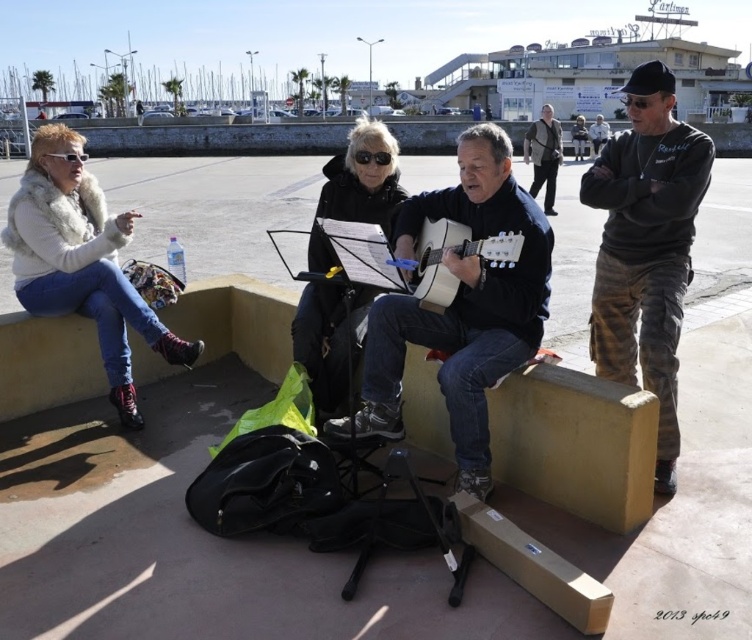
Question: Is matte black guitar at center positioned in front of fuzzy white fur vest at left?

Choices:
 (A) yes
 (B) no

Answer: (A)

Question: Which of the following is the closest to the observer?

Choices:
 (A) (411, 218)
 (B) (543, 120)
 (C) (438, 252)

Answer: (C)

Question: Is matte black guitar at center bigger than black matte jacket at center?

Choices:
 (A) no
 (B) yes

Answer: (A)

Question: Based on their relative distances, which object is nearer to the black cotton sweatshirt at right?

Choices:
 (A) dark gray vest at center
 (B) black matte jacket at center
 (C) matte black guitar at center

Answer: (C)

Question: Considering the real-world distances, which object is farthest from the matte black guitar at center?

Choices:
 (A) fuzzy white fur vest at left
 (B) acoustic guitar at center
 (C) dark gray vest at center

Answer: (C)

Question: Does matte black guitar at center have a greater width compared to black cotton sweatshirt at right?

Choices:
 (A) yes
 (B) no

Answer: (A)